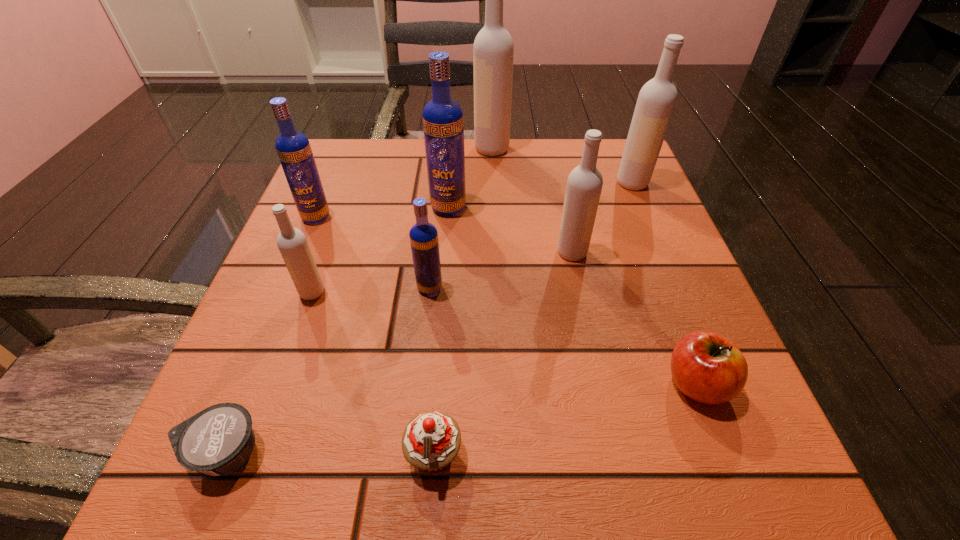
Where is `vodka identified as the closest to the sixth nearest vodka`? This screenshot has height=540, width=960. vodka identified as the closest to the sixth nearest vodka is located at coordinates (584, 185).

This screenshot has width=960, height=540. In order to click on vodka identified as the fourth closest to the farthest object in this screenshot , I will do pyautogui.click(x=293, y=148).

Image resolution: width=960 pixels, height=540 pixels. I want to click on white vodka that stands as the closest to the leftmost blue vodka, so click(x=292, y=243).

Point out which white vodka is positioned as the nearest to the third white vodka from left to right. Please provide its 2D coordinates. Your answer should be formatted as a tuple, i.e. [(x, y)], where the tuple contains the x and y coordinates of a point satisfying the conditions above.

[(657, 98)]

Image resolution: width=960 pixels, height=540 pixels. Find the location of `blue vodka that stands as the second closest to the smallest blue vodka`. blue vodka that stands as the second closest to the smallest blue vodka is located at coordinates (293, 148).

At what (x,y) coordinates should I click in order to perform the action: click on blue vodka that is the second closest to the nearest blue vodka. Please return your answer as a coordinate pair (x, y). Looking at the image, I should click on (293, 148).

Image resolution: width=960 pixels, height=540 pixels. In order to click on vacant space that satisfies the following two spatial constraints: 1. on the front side of the leftmost blue vodka; 2. on the left side of the third nearest vodka in this screenshot , I will do `click(301, 252)`.

Where is `vacant region that satisfies the following two spatial constraints: 1. on the back side of the second vodka from right to left; 2. on the right side of the smallest blue vodka`? This screenshot has height=540, width=960. vacant region that satisfies the following two spatial constraints: 1. on the back side of the second vodka from right to left; 2. on the right side of the smallest blue vodka is located at coordinates (434, 252).

Where is `vacant region that satisfies the following two spatial constraints: 1. on the front side of the second biggest blue vodka; 2. on the right side of the nearest white vodka`? vacant region that satisfies the following two spatial constraints: 1. on the front side of the second biggest blue vodka; 2. on the right side of the nearest white vodka is located at coordinates (285, 293).

The image size is (960, 540). Find the location of `vacant point that satisfies the following two spatial constraints: 1. on the front side of the second white vodka from left to right; 2. on the left side of the third nearest object`. vacant point that satisfies the following two spatial constraints: 1. on the front side of the second white vodka from left to right; 2. on the left side of the third nearest object is located at coordinates (500, 383).